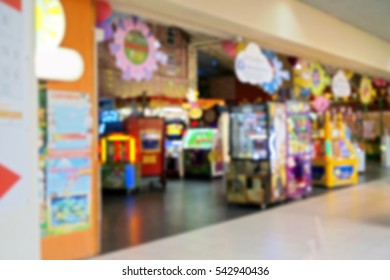
I want to click on black tile, so click(x=183, y=216).